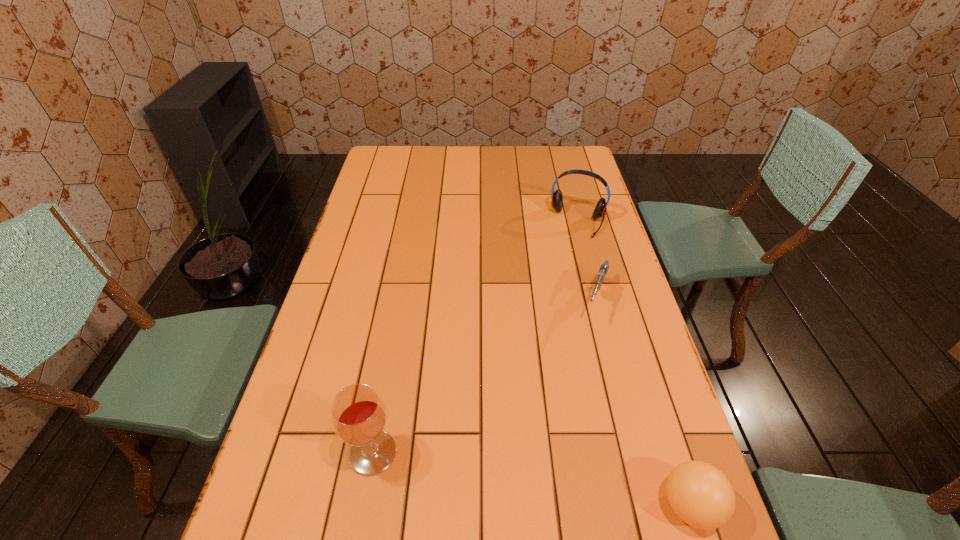
This screenshot has height=540, width=960. Identify the location of free area in between the farthest object and the ping-pong ball. (635, 363).

Where is `free spot between the wineglass and the ping-pong ball`? free spot between the wineglass and the ping-pong ball is located at coordinates (531, 479).

The image size is (960, 540). Find the location of `object that is the third closest to the ping-pong ball`. object that is the third closest to the ping-pong ball is located at coordinates (556, 197).

Choose which object is the third nearest neighbor to the ping-pong ball. Please provide its 2D coordinates. Your answer should be formatted as a tuple, i.e. [(x, y)], where the tuple contains the x and y coordinates of a point satisfying the conditions above.

[(556, 197)]

Locate an element on the screen. This screenshot has height=540, width=960. vacant area in the image that satisfies the following two spatial constraints: 1. on the back side of the leftmost object; 2. on the left side of the farthest object is located at coordinates (414, 221).

Find the location of a particular element. Image resolution: width=960 pixels, height=540 pixels. free space that satisfies the following two spatial constraints: 1. on the front side of the wineglass; 2. on the side with brand of the ping-pong ball is located at coordinates (363, 505).

At what (x,y) coordinates should I click in order to perform the action: click on vacant position in the image that satisfies the following two spatial constraints: 1. on the front side of the ping-pong ball; 2. on the side with brand of the farthest object. Please return your answer as a coordinate pair (x, y). Looking at the image, I should click on (654, 505).

Locate an element on the screen. The image size is (960, 540). vacant area that satisfies the following two spatial constraints: 1. on the back side of the gun; 2. on the right side of the leftmost object is located at coordinates (399, 301).